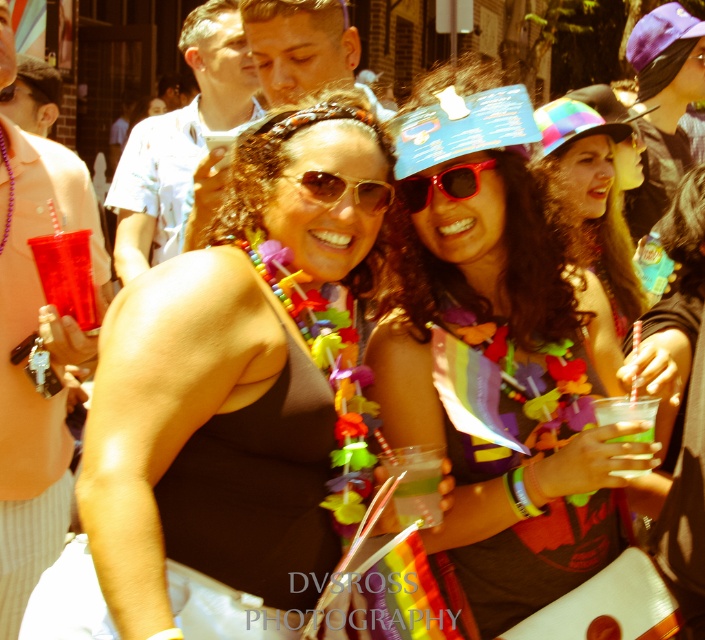
Question: Does transparent plastic cup at left appear on the right side of gold metallic sunglasses at center?

Choices:
 (A) yes
 (B) no

Answer: (B)

Question: Which point is farther to the camera?

Choices:
 (A) transparent plastic cup at left
 (B) matte plastic cup at center
 (C) green translucent glass at center

Answer: (A)

Question: Which of the following is the closest to the observer?

Choices:
 (A) (627, 442)
 (B) (153, 429)
 (C) (410, 193)

Answer: (A)

Question: Does matte black dress at center have a greater width compared to transparent plastic cup at left?

Choices:
 (A) yes
 (B) no

Answer: (A)

Question: Which point is closer to the camera?

Choices:
 (A) matte plastic cup at center
 (B) gold metallic sunglasses at center
 (C) clear plastic cup at lower right

Answer: (A)

Question: Can you confirm if matte plastic cup at center is positioned below green translucent glass at center?

Choices:
 (A) yes
 (B) no

Answer: (B)